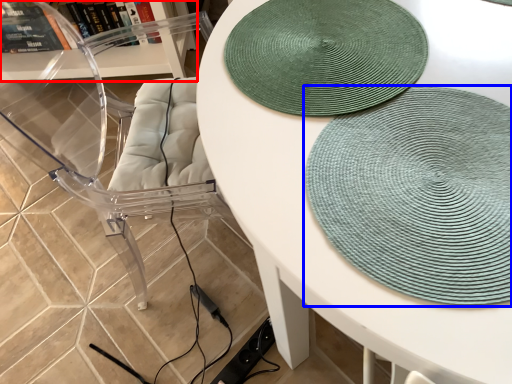
Question: Which object is further to the camera taking this photo, shelf (highlighted by a red box) or mat (highlighted by a blue box)?

Choices:
 (A) shelf
 (B) mat

Answer: (A)